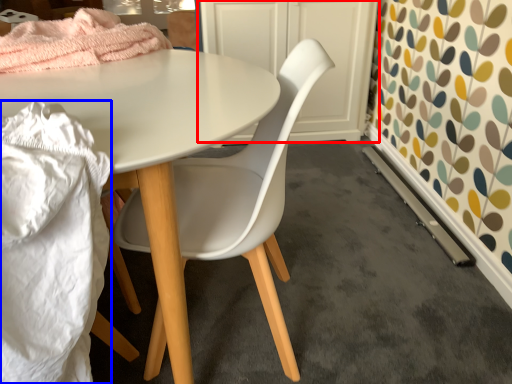
Question: Which point is closer to the camera, cabinetry (highlighted by a red box) or material (highlighted by a blue box)?

Choices:
 (A) cabinetry
 (B) material

Answer: (B)